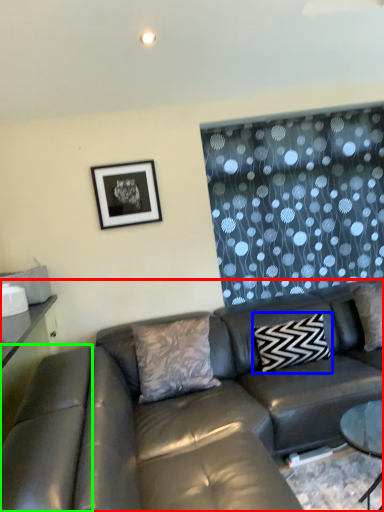
Question: Which object is positioned closest to studio couch (highlighted by a red box)? Select from pillow (highlighted by a blue box) and swivel chair (highlighted by a green box).

Choices:
 (A) pillow
 (B) swivel chair

Answer: (B)